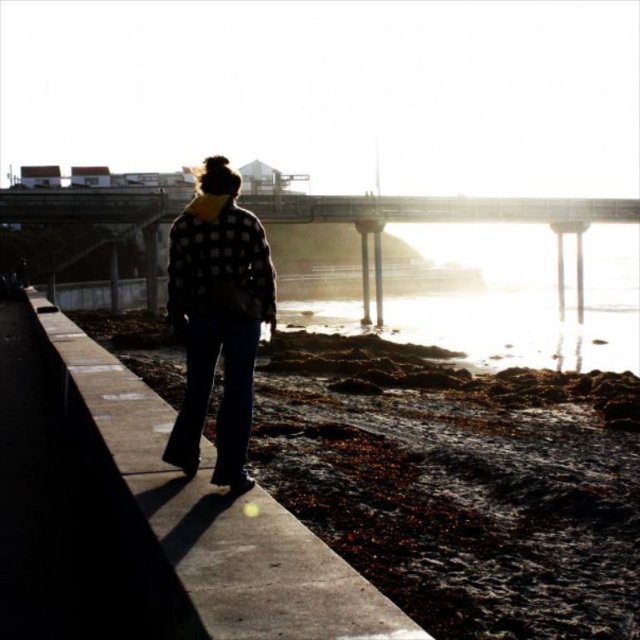
You are a photographer trying to capture the entire scene of the concrete at center and the checkered fabric jacket at center in one shot. Based on their sizes, which object should you focus on to ensure both are clearly visible in the frame?

The concrete at center is larger in size than the checkered fabric jacket at center, so focusing on the concrete at center will help ensure both objects are clearly visible in the frame.

From the picture: You are a photographer trying to capture the checkered fabric jacket at center and the concrete at center in the same frame. Based on their sizes, which object would appear larger in the photo?

The concrete at center is wider than the checkered fabric jacket at center, so it would appear larger in the photo.

You are a construction worker planning to install a safety barrier between the concrete at center and the checkered fabric jacket at center. If your barrier requires 1 meter of space on each side, will there be enough room for the barrier between them?

The distance between the concrete at center and the checkered fabric jacket at center is 7.41 meters. Subtracting the required 2 meters of space for the barrier, there remains 5.41 meters, so yes, there is sufficient space for the barrier.